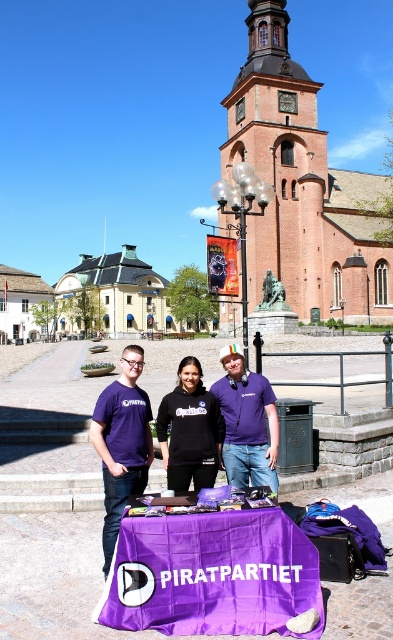
Question: Based on their relative distances, which object is farther from the red brick church at center?

Choices:
 (A) black matte sweatshirt at center
 (B) purple cotton t-shirt at center

Answer: (A)

Question: Which object appears closest to the camera in this image?

Choices:
 (A) purple cotton t-shirt at center
 (B) black matte sweatshirt at center
 (C) black matte hoodie at center

Answer: (C)

Question: Which point is closer to the camera taking this photo?

Choices:
 (A) (202, 392)
 (B) (288, 280)
 (C) (277, 429)
 (D) (150, 442)

Answer: (D)

Question: Does red brick church at center lie in front of purple cotton t-shirt at center?

Choices:
 (A) no
 (B) yes

Answer: (A)

Question: Does red brick church at center appear on the left side of black matte sweatshirt at center?

Choices:
 (A) no
 (B) yes

Answer: (A)

Question: Is black matte hoodie at center to the right of black matte sweatshirt at center from the viewer's perspective?

Choices:
 (A) yes
 (B) no

Answer: (B)